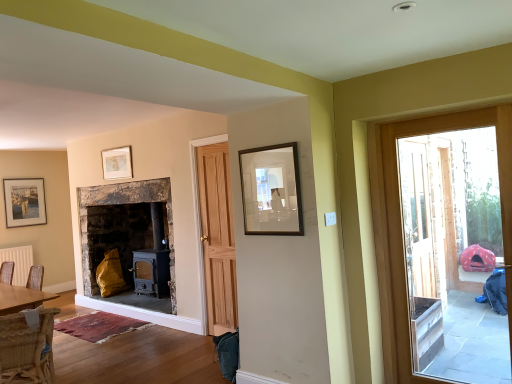
The image size is (512, 384). What do you see at coordinates (27, 348) in the screenshot?
I see `woven wicker chair at lower left` at bounding box center [27, 348].

The height and width of the screenshot is (384, 512). What do you see at coordinates (271, 190) in the screenshot? I see `wooden frame at upper center, the 1th picture frame when ordered from front to back` at bounding box center [271, 190].

In order to face matte black picture frame at upper left, the 3th picture frame positioned from the front, should I rotate leftwards or rightwards?

It's best to rotate left around 28.170 degrees.

The height and width of the screenshot is (384, 512). What do you see at coordinates (24, 202) in the screenshot? I see `matte black picture frame at upper left, which is counted as the 3th picture frame, starting from the right` at bounding box center [24, 202].

What is the approximate width of white matte radiator at lower left?

white matte radiator at lower left is 5.03 inches in width.

Measure the distance between matte gold picture frame at upper center, which is counted as the 2th picture frame, starting from the right, and camera.

matte gold picture frame at upper center, which is counted as the 2th picture frame, starting from the right, and camera are 5.23 meters apart.

Locate an element on the screen. The width and height of the screenshot is (512, 384). woven wicker chair at lower left is located at coordinates (27, 348).

Considering the points (114, 167) and (257, 163), which point is in front, point (114, 167) or point (257, 163)?

Point (257, 163)

Which is behind, matte gold picture frame at upper center, which is the 2th picture frame from left to right, or wooden frame at upper center, acting as the 3th picture frame starting from the back?

matte gold picture frame at upper center, which is the 2th picture frame from left to right, is further from the camera.

Would you say wooden frame at upper center, acting as the third picture frame starting from the left, is part of matte gold picture frame at upper center, which is counted as the 2th picture frame, starting from the right,'s contents?

No, wooden frame at upper center, acting as the third picture frame starting from the left, is not inside matte gold picture frame at upper center, which is counted as the 2th picture frame, starting from the right.

Considering the relative positions of matte gold picture frame at upper center, which is counted as the 2th picture frame, starting from the right, and wooden frame at upper center, acting as the third picture frame starting from the left, in the image provided, is matte gold picture frame at upper center, which is counted as the 2th picture frame, starting from the right, to the left of wooden frame at upper center, acting as the third picture frame starting from the left, from the viewer's perspective?

Yes.

Considering the sizes of objects wooden frame at upper center, which ranks as the first picture frame in right-to-left order, and woven wicker chair at lower left in the image provided, who is bigger, wooden frame at upper center, which ranks as the first picture frame in right-to-left order, or woven wicker chair at lower left?

woven wicker chair at lower left.

Looking at this image, is wooden frame at upper center, acting as the third picture frame starting from the left, facing away from woven wicker chair at lower left?

wooden frame at upper center, acting as the third picture frame starting from the left, does not have its back to woven wicker chair at lower left.

Find the location of `picture frame that is the 2nd one when counting downward from the matte gold picture frame at upper center, which is counted as the 2th picture frame, starting from the right (from the image's perspective)`. picture frame that is the 2nd one when counting downward from the matte gold picture frame at upper center, which is counted as the 2th picture frame, starting from the right (from the image's perspective) is located at coordinates (24, 202).

Is matte gold picture frame at upper center, which is counted as the 2th picture frame, starting from the right, in front of matte black picture frame at upper left, which is counted as the 3th picture frame, starting from the right?

Yes.

From a real-world perspective, is matte gold picture frame at upper center, which is counted as the 2th picture frame, starting from the right, physically located above or below matte black picture frame at upper left, which is the 1th picture frame from back to front?

matte gold picture frame at upper center, which is counted as the 2th picture frame, starting from the right, is above matte black picture frame at upper left, which is the 1th picture frame from back to front.

What's the angular difference between matte gold picture frame at upper center, the second picture frame when ordered from front to back, and matte black picture frame at upper left, the 3th picture frame positioned from the front,'s facing directions?

The facing directions of matte gold picture frame at upper center, the second picture frame when ordered from front to back, and matte black picture frame at upper left, the 3th picture frame positioned from the front, are 90 degrees apart.

Based on the photo, is white matte radiator at lower left smaller than woven wicker chair at lower left?

Yes.

Is white matte radiator at lower left taller or shorter than woven wicker chair at lower left?

Clearly, white matte radiator at lower left is shorter compared to woven wicker chair at lower left.

From a real-world perspective, is white matte radiator at lower left over woven wicker chair at lower left?

Indeed, from a real-world perspective, white matte radiator at lower left stands above woven wicker chair at lower left.

Consider the image. Is white matte radiator at lower left inside matte gold picture frame at upper center, which is counted as the 2th picture frame, starting from the right?

No, white matte radiator at lower left is not inside matte gold picture frame at upper center, which is counted as the 2th picture frame, starting from the right.

Can you confirm if matte gold picture frame at upper center, the second picture frame when ordered from front to back, is smaller than white matte radiator at lower left?

Correct, matte gold picture frame at upper center, the second picture frame when ordered from front to back, occupies less space than white matte radiator at lower left.

In the scene shown: Is matte gold picture frame at upper center, which is counted as the 2th picture frame, starting from the right, not near white matte radiator at lower left?

Absolutely, matte gold picture frame at upper center, which is counted as the 2th picture frame, starting from the right, is distant from white matte radiator at lower left.

From the image's perspective, is matte gold picture frame at upper center, which is counted as the 2th picture frame, starting from the right, located above white matte radiator at lower left?

Yes, from the image's perspective, matte gold picture frame at upper center, which is counted as the 2th picture frame, starting from the right, is above white matte radiator at lower left.

Looking at this image, which is farther from the camera, (106,171) or (432,173)?

Positioned behind is point (106,171).

Can you confirm if matte gold picture frame at upper center, the second picture frame when ordered from front to back, is taller than wooden door at right?

No, matte gold picture frame at upper center, the second picture frame when ordered from front to back, is not taller than wooden door at right.

Is matte gold picture frame at upper center, acting as the second picture frame starting from the back, bigger than wooden door at right?

Actually, matte gold picture frame at upper center, acting as the second picture frame starting from the back, might be smaller than wooden door at right.

From the image's perspective, would you say matte gold picture frame at upper center, acting as the second picture frame starting from the back, is positioned over wooden door at right?

Yes, from the image's perspective, matte gold picture frame at upper center, acting as the second picture frame starting from the back, is on top of wooden door at right.

Consider the image. How far apart are matte black picture frame at upper left, which is the 1th picture frame from back to front, and wooden frame at upper center, acting as the third picture frame starting from the left?

matte black picture frame at upper left, which is the 1th picture frame from back to front, is 4.46 meters away from wooden frame at upper center, acting as the third picture frame starting from the left.

Which of these two, matte black picture frame at upper left, the 3th picture frame positioned from the front, or wooden frame at upper center, acting as the 3th picture frame starting from the back, is smaller?

wooden frame at upper center, acting as the 3th picture frame starting from the back.

What's the angular difference between matte black picture frame at upper left, which is the 1th picture frame from back to front, and wooden frame at upper center, acting as the third picture frame starting from the left,'s facing directions?

89 degrees separate the facing orientations of matte black picture frame at upper left, which is the 1th picture frame from back to front, and wooden frame at upper center, acting as the third picture frame starting from the left.

Is matte black picture frame at upper left, which is the 1th picture frame from back to front, next to wooden frame at upper center, which ranks as the first picture frame in right-to-left order?

No, matte black picture frame at upper left, which is the 1th picture frame from back to front, is not making contact with wooden frame at upper center, which ranks as the first picture frame in right-to-left order.

In order to click on picture frame that appears above the wooden frame at upper center, which ranks as the first picture frame in right-to-left order (from the image's perspective) in this screenshot , I will do `click(117, 163)`.

The width and height of the screenshot is (512, 384). I want to click on picture frame that is in front of the woven wicker chair at lower left, so click(x=271, y=190).

Considering their positions, is white matte radiator at lower left positioned further to wooden door at right than matte black picture frame at upper left, which is counted as the 3th picture frame, starting from the right?

matte black picture frame at upper left, which is counted as the 3th picture frame, starting from the right, lies further to wooden door at right than the other object.

Considering their positions, is white matte radiator at lower left positioned closer to woven wicker chair at lower left than matte black picture frame at upper left, which is the 1th picture frame from back to front?

Based on the image, white matte radiator at lower left appears to be nearer to woven wicker chair at lower left.

From the image, which object appears to be nearer to white matte radiator at lower left, wooden frame at upper center, which ranks as the first picture frame in right-to-left order, or woven wicker chair at lower left?

woven wicker chair at lower left is closer to white matte radiator at lower left.

Based on their spatial positions, is wooden frame at upper center, acting as the third picture frame starting from the left, or woven wicker chair at lower left closer to matte gold picture frame at upper center, the second picture frame when ordered from front to back?

woven wicker chair at lower left is positioned closer to the anchor matte gold picture frame at upper center, the second picture frame when ordered from front to back.

Based on their spatial positions, is wooden frame at upper center, the 1th picture frame when ordered from front to back, or wooden door at right further from matte black picture frame at upper left, which appears as the first picture frame when viewed from the left?

wooden door at right lies further to matte black picture frame at upper left, which appears as the first picture frame when viewed from the left, than the other object.

Based on their spatial positions, is matte gold picture frame at upper center, which is counted as the 2th picture frame, starting from the right, or white matte radiator at lower left closer to wooden frame at upper center, the 1th picture frame when ordered from front to back?

Among the two, white matte radiator at lower left is located nearer to wooden frame at upper center, the 1th picture frame when ordered from front to back.

Which object lies nearer to the anchor point wooden door at right, woven wicker chair at lower left or matte black picture frame at upper left, which appears as the first picture frame when viewed from the left?

Based on the image, woven wicker chair at lower left appears to be nearer to wooden door at right.

Consider the image. When comparing their distances from wooden door at right, does wooden frame at upper center, which ranks as the first picture frame in right-to-left order, or white matte radiator at lower left seem further?

Among the two, white matte radiator at lower left is located further to wooden door at right.

The image size is (512, 384). I want to click on picture frame between woven wicker chair at lower left and matte black picture frame at upper left, which is the 1th picture frame from back to front, along the z-axis, so click(117, 163).

Find the location of `picture frame located between woven wicker chair at lower left and white matte radiator at lower left in the depth direction`. picture frame located between woven wicker chair at lower left and white matte radiator at lower left in the depth direction is located at coordinates (117, 163).

Image resolution: width=512 pixels, height=384 pixels. Find the location of `picture frame between wooden frame at upper center, acting as the third picture frame starting from the left, and matte black picture frame at upper left, which is the 1th picture frame from back to front, from front to back`. picture frame between wooden frame at upper center, acting as the third picture frame starting from the left, and matte black picture frame at upper left, which is the 1th picture frame from back to front, from front to back is located at coordinates (117, 163).

At what (x,y) coordinates should I click in order to perform the action: click on chair located between wooden frame at upper center, acting as the 3th picture frame starting from the back, and matte gold picture frame at upper center, which is the 2th picture frame from left to right, in the depth direction. Please return your answer as a coordinate pair (x, y). Looking at the image, I should click on (27, 348).